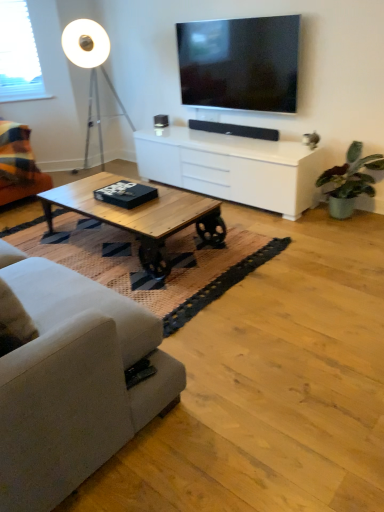
Question: From a real-world perspective, is plaid fabric couch at left, which is the 2th studio couch from bottom to top, beneath green matte plant at right?

Choices:
 (A) no
 (B) yes

Answer: (A)

Question: Does plaid fabric couch at left, acting as the second studio couch starting from the front, have a greater width compared to green matte plant at right?

Choices:
 (A) yes
 (B) no

Answer: (A)

Question: Would you consider plaid fabric couch at left, the 1th studio couch viewed from the back, to be distant from green matte plant at right?

Choices:
 (A) no
 (B) yes

Answer: (B)

Question: Considering the relative sizes of plaid fabric couch at left, which is the 2th studio couch from bottom to top, and green matte plant at right in the image provided, is plaid fabric couch at left, which is the 2th studio couch from bottom to top, taller than green matte plant at right?

Choices:
 (A) yes
 (B) no

Answer: (A)

Question: Does plaid fabric couch at left, the 1th studio couch viewed from the back, come behind green matte plant at right?

Choices:
 (A) yes
 (B) no

Answer: (A)

Question: Does point (268, 33) appear closer or farther from the camera than point (74, 473)?

Choices:
 (A) closer
 (B) farther

Answer: (B)

Question: From the image's perspective, is flat screen tv at upper center positioned above or below light gray fabric couch at left, the 1th studio couch in the bottom-to-top sequence?

Choices:
 (A) above
 (B) below

Answer: (A)

Question: From a real-world perspective, is flat screen tv at upper center physically located above or below light gray fabric couch at left, which is counted as the 2th studio couch, starting from the back?

Choices:
 (A) below
 (B) above

Answer: (B)

Question: Based on their sizes in the image, would you say flat screen tv at upper center is bigger or smaller than light gray fabric couch at left, marked as the 2th studio couch in a top-to-bottom arrangement?

Choices:
 (A) big
 (B) small

Answer: (B)

Question: From the image's perspective, is woodenmaterial/texturecoffee table at center located above or below light gray fabric couch at left, marked as the 2th studio couch in a top-to-bottom arrangement?

Choices:
 (A) above
 (B) below

Answer: (A)

Question: Is woodenmaterial/texturecoffee table at center taller or shorter than light gray fabric couch at left, marked as the 2th studio couch in a top-to-bottom arrangement?

Choices:
 (A) tall
 (B) short

Answer: (B)

Question: Based on their positions, is woodenmaterial/texturecoffee table at center located to the left or right of light gray fabric couch at left, marked as the 2th studio couch in a top-to-bottom arrangement?

Choices:
 (A) left
 (B) right

Answer: (B)

Question: Looking at their shapes, would you say woodenmaterial/texturecoffee table at center is wider or thinner than light gray fabric couch at left, which is counted as the 2th studio couch, starting from the back?

Choices:
 (A) thin
 (B) wide

Answer: (A)

Question: From their relative heights in the image, would you say white plastic window screen at upper left is taller or shorter than flat screen tv at upper center?

Choices:
 (A) short
 (B) tall

Answer: (B)

Question: Is point (16, 96) positioned closer to the camera than point (296, 25)?

Choices:
 (A) farther
 (B) closer

Answer: (A)